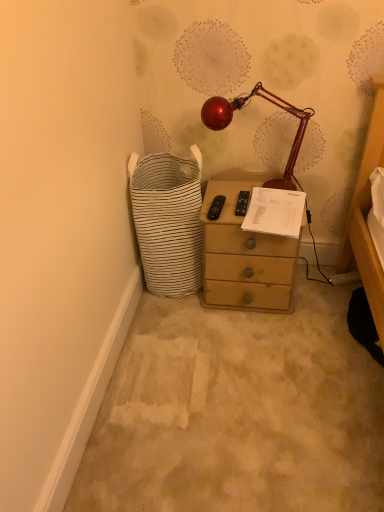
The height and width of the screenshot is (512, 384). In order to click on free spot above wooden drawer at center (from a real-world perspective) in this screenshot , I will do `click(251, 373)`.